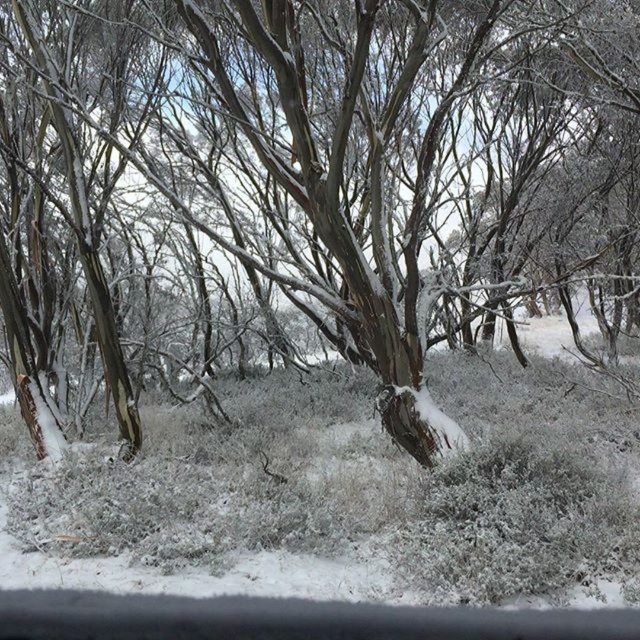
Question: Is smooth bark tree at center in front of white fluffy grass at center?

Choices:
 (A) yes
 (B) no

Answer: (A)

Question: Can you confirm if smooth bark tree at center is positioned above white fluffy grass at center?

Choices:
 (A) yes
 (B) no

Answer: (A)

Question: Which of the following is the farthest from the observer?

Choices:
 (A) coord(554,168)
 (B) coord(246,385)

Answer: (A)

Question: Among these points, which one is nearest to the camera?

Choices:
 (A) (269, 157)
 (B) (506, 572)

Answer: (B)

Question: Does smooth bark tree at center appear on the right side of white fluffy grass at center?

Choices:
 (A) yes
 (B) no

Answer: (A)